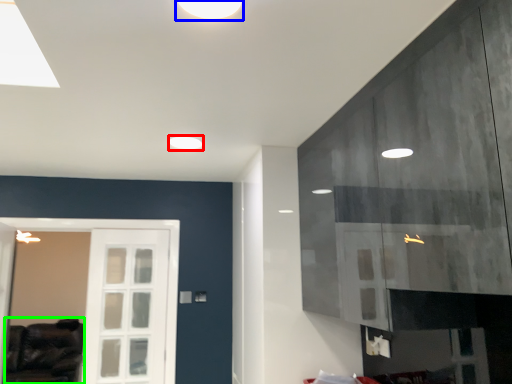
Question: Which object is the farthest from lighting (highlighted by a red box)? Choose among these: lighting (highlighted by a blue box) or furniture (highlighted by a green box).

Choices:
 (A) lighting
 (B) furniture

Answer: (B)